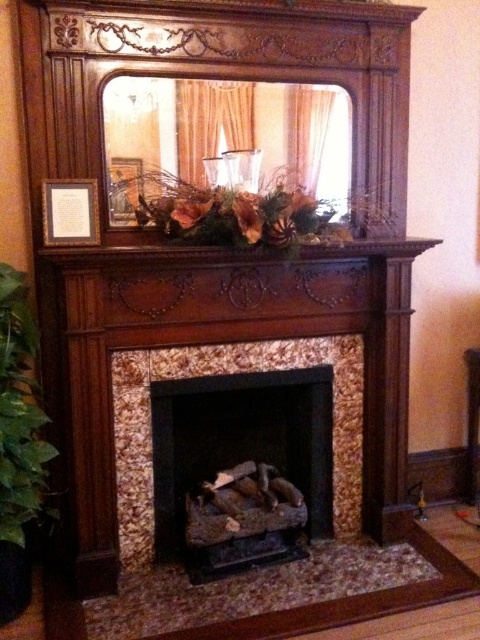
Question: Which of the following is the closest to the observer?

Choices:
 (A) green leafy plant at left
 (B) brown leather armchair at right
 (C) matte glass mirror at upper center

Answer: (A)

Question: Does black stone fireplace at center have a smaller size compared to brown leather armchair at right?

Choices:
 (A) no
 (B) yes

Answer: (A)

Question: Which of the following is the farthest from the observer?

Choices:
 (A) matte gold picture frame at upper center
 (B) wooden mantel at upper center
 (C) brown leather armchair at right

Answer: (C)

Question: Is black stone fireplace at center positioned in front of matte gold picture frame at upper center?

Choices:
 (A) no
 (B) yes

Answer: (A)

Question: Based on their relative distances, which object is farther from the matte brown picture frame at upper left?

Choices:
 (A) brown leather armchair at right
 (B) black stone fireplace at center
 (C) matte glass mirror at upper center
 (D) matte gold picture frame at upper center

Answer: (A)

Question: Does matte gold picture frame at upper center have a smaller size compared to brown leather armchair at right?

Choices:
 (A) yes
 (B) no

Answer: (A)